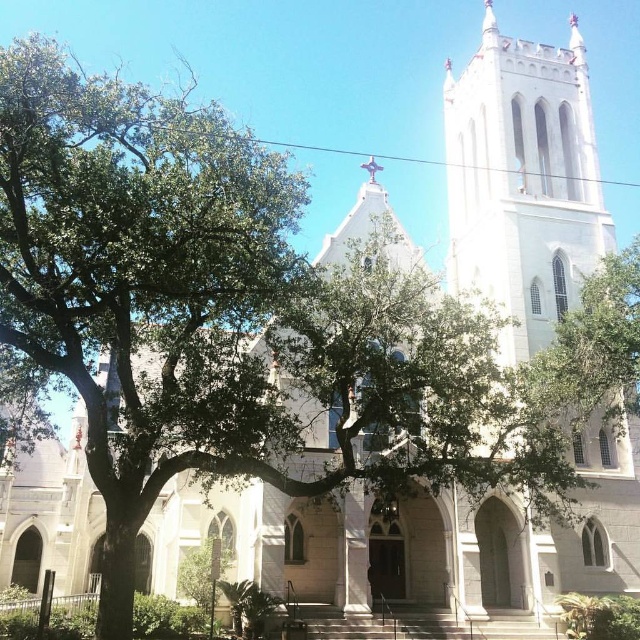
Question: Is white stone tower at upper right thinner than green leafy tree at upper right?

Choices:
 (A) yes
 (B) no

Answer: (B)

Question: Can you confirm if white stone tower at upper right is smaller than green leafy tree at upper right?

Choices:
 (A) yes
 (B) no

Answer: (B)

Question: Which of the following is the closest to the observer?

Choices:
 (A) (618, 300)
 (B) (484, 36)

Answer: (A)

Question: Which point is closer to the camera taking this photo?

Choices:
 (A) (477, 186)
 (B) (573, 394)

Answer: (B)

Question: Is white stone tower at upper right wider than green leafy tree at upper right?

Choices:
 (A) yes
 (B) no

Answer: (A)